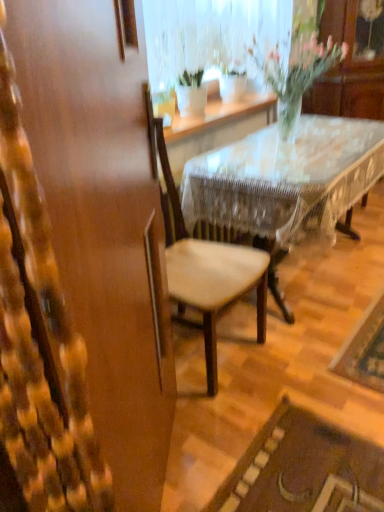
Question: Is wooden lace-covered table at center completely or partially outside of wooden chair at center?

Choices:
 (A) no
 (B) yes

Answer: (B)

Question: Could you tell me if wooden lace-covered table at center is turned towards wooden chair at center?

Choices:
 (A) no
 (B) yes

Answer: (A)

Question: Is wooden lace-covered table at center at the right side of wooden chair at center?

Choices:
 (A) yes
 (B) no

Answer: (A)

Question: Does wooden lace-covered table at center have a larger size compared to wooden chair at center?

Choices:
 (A) no
 (B) yes

Answer: (B)

Question: Does wooden lace-covered table at center have a lesser width compared to wooden chair at center?

Choices:
 (A) no
 (B) yes

Answer: (A)

Question: Is wooden lace-covered table at center far from wooden chair at center?

Choices:
 (A) yes
 (B) no

Answer: (B)

Question: Does wooden lace-covered table at center have a smaller size compared to translucent glass vase at upper center?

Choices:
 (A) yes
 (B) no

Answer: (B)

Question: Is wooden lace-covered table at center positioned before translucent glass vase at upper center?

Choices:
 (A) no
 (B) yes

Answer: (B)

Question: From a real-world perspective, is wooden lace-covered table at center positioned under translucent glass vase at upper center based on gravity?

Choices:
 (A) no
 (B) yes

Answer: (B)

Question: From the image's perspective, does wooden lace-covered table at center appear lower than translucent glass vase at upper center?

Choices:
 (A) no
 (B) yes

Answer: (B)

Question: Can you see wooden lace-covered table at center touching translucent glass vase at upper center?

Choices:
 (A) yes
 (B) no

Answer: (B)

Question: Considering the relative positions of wooden lace-covered table at center and translucent glass vase at upper center in the image provided, is wooden lace-covered table at center behind translucent glass vase at upper center?

Choices:
 (A) yes
 (B) no

Answer: (B)

Question: Considering the relative positions of translucent glass vase at upper center and wooden chair at center in the image provided, is translucent glass vase at upper center to the right of wooden chair at center from the viewer's perspective?

Choices:
 (A) no
 (B) yes

Answer: (B)